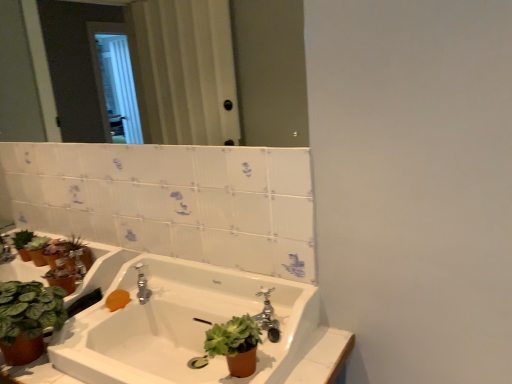
Question: Considering the relative positions of silver metallic faucet at center and clear glass mirror at upper center in the image provided, is silver metallic faucet at center to the left or to the right of clear glass mirror at upper center?

Choices:
 (A) left
 (B) right

Answer: (B)

Question: Considering their positions, is silver metallic faucet at center located in front of or behind clear glass mirror at upper center?

Choices:
 (A) front
 (B) behind

Answer: (B)

Question: Considering the real-world distances, which object is closest to the green matte succulent at lower center?

Choices:
 (A) white glossy sink at center
 (B) orange matte soap at lower left
 (C) clear glass mirror at upper center
 (D) silver metallic faucet at center

Answer: (A)

Question: Based on their relative distances, which object is nearer to the silver metallic faucet at center?

Choices:
 (A) clear glass mirror at upper center
 (B) white glossy sink at center
 (C) green matte succulent at lower center
 (D) orange matte soap at lower left

Answer: (D)